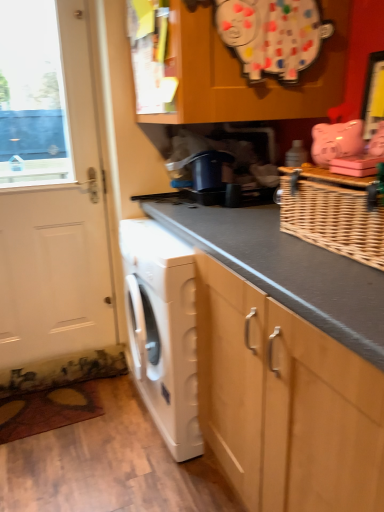
What do you see at coordinates (163, 330) in the screenshot? I see `white matte washing machine at lower left` at bounding box center [163, 330].

What are the coordinates of `wooden cabinet at upper center` in the screenshot? It's located at (244, 78).

Between point (172, 30) and point (382, 244), which one is positioned in front?

The point (382, 244) is closer.

Is woven brown basket at upper right inside wooden cabinet at upper center?

No.

From a real-world perspective, is wooden cabinet at upper center positioned over woven brown basket at upper right based on gravity?

Indeed, from a real-world perspective, wooden cabinet at upper center stands above woven brown basket at upper right.

Between wooden cabinet at upper center and woven brown basket at upper right, which one has smaller width?

woven brown basket at upper right.

Based on the photo, which is closer, (x=15, y=355) or (x=213, y=62)?

Clearly, point (x=15, y=355) is more distant from the camera than point (x=213, y=62).

From the image's perspective, between white matte door at left and wooden cabinet at upper center, which one is located above?

From the image's view, wooden cabinet at upper center is above.

Considering the sizes of objects white matte door at left and wooden cabinet at upper center in the image provided, who is bigger, white matte door at left or wooden cabinet at upper center?

With larger size is wooden cabinet at upper center.

Are wooden cabinet at upper center and white matte washing machine at lower left far apart?

No, wooden cabinet at upper center is in close proximity to white matte washing machine at lower left.

How many degrees apart are the facing directions of wooden cabinet at upper center and white matte washing machine at lower left?

The facing directions of wooden cabinet at upper center and white matte washing machine at lower left are 87.9 degrees apart.

Looking at this image, can we say wooden cabinet at upper center lies outside white matte washing machine at lower left?

Yes, wooden cabinet at upper center is outside of white matte washing machine at lower left.

From the image's perspective, between white matte washing machine at lower left and wooden cabinet at upper center, who is located below?

white matte washing machine at lower left appears lower in the image.

Which of these two, white matte washing machine at lower left or wooden cabinet at upper center, is bigger?

With larger size is white matte washing machine at lower left.

Which is farther, (129, 362) or (257, 108)?

The point (129, 362) is more distant.

Is white matte washing machine at lower left positioned far away from wooden cabinet at upper center?

white matte washing machine at lower left is actually quite close to wooden cabinet at upper center.

Based on the photo, from a real-world perspective, is white matte door at left positioned over woven brown basket at upper right based on gravity?

→ Actually, white matte door at left is physically below woven brown basket at upper right in the real world.

Is white matte door at left not close to woven brown basket at upper right?

Indeed, white matte door at left is not near woven brown basket at upper right.

Find the location of a particular element. This screenshot has width=384, height=512. door behind the woven brown basket at upper right is located at coordinates (51, 191).

Who is bigger, white matte door at left or woven brown basket at upper right?

white matte door at left is bigger.

Does woven brown basket at upper right turn towards wooden cabinet at upper center?

No, woven brown basket at upper right is not turned towards wooden cabinet at upper center.

Between point (314, 183) and point (337, 7), which one is positioned in front?

The point (314, 183) is closer to the camera.

Identify the location of cabinetry behind the woven brown basket at upper right. (244, 78).

Considering the relative positions of woven brown basket at upper right and wooden cabinet at upper center in the image provided, is woven brown basket at upper right to the left or to the right of wooden cabinet at upper center?

woven brown basket at upper right is positioned on wooden cabinet at upper center's right side.

In the scene shown: Who is more distant, white matte washing machine at lower left or white matte door at left?

white matte door at left is more distant.

From a real-world perspective, does white matte washing machine at lower left stand above white matte door at left?

No, from a real-world perspective, white matte washing machine at lower left is not on top of white matte door at left.

Could you tell me if white matte washing machine at lower left is turned towards white matte door at left?

No.

In the scene shown: Would you say white matte washing machine at lower left is a long distance from white matte door at left?

That's not correct — white matte washing machine at lower left is a little close to white matte door at left.

Where is `cabinetry lying on the left of woven brown basket at upper right`? cabinetry lying on the left of woven brown basket at upper right is located at coordinates (244, 78).

Find the location of a particular element. This screenshot has width=384, height=512. door below the wooden cabinet at upper center (from the image's perspective) is located at coordinates (51, 191).

From the picture: When comparing their distances from woven brown basket at upper right, does wooden cabinet at upper center or white matte washing machine at lower left seem closer?

wooden cabinet at upper center is closer to woven brown basket at upper right.

Which object lies further to the anchor point white matte door at left, woven brown basket at upper right or wooden cabinet at upper center?

woven brown basket at upper right is further to white matte door at left.

Based on their spatial positions, is white matte door at left or white matte washing machine at lower left further from wooden cabinet at upper center?

The object further to wooden cabinet at upper center is white matte door at left.

Estimate the real-world distances between objects in this image. Which object is further from woven brown basket at upper right, white matte washing machine at lower left or white matte door at left?

white matte door at left is positioned further to the anchor woven brown basket at upper right.

In the scene shown: When comparing their distances from woven brown basket at upper right, does white matte door at left or wooden cabinet at upper center seem further?

The object further to woven brown basket at upper right is white matte door at left.

From the image, which object appears to be nearer to woven brown basket at upper right, white matte washing machine at lower left or wooden cabinet at upper center?

Among the two, wooden cabinet at upper center is located nearer to woven brown basket at upper right.

Estimate the real-world distances between objects in this image. Which object is further from wooden cabinet at upper center, white matte washing machine at lower left or woven brown basket at upper right?

white matte washing machine at lower left lies further to wooden cabinet at upper center than the other object.

Which object lies nearer to the anchor point white matte door at left, wooden cabinet at upper center or white matte washing machine at lower left?

Among the two, white matte washing machine at lower left is located nearer to white matte door at left.

You are a GUI agent. You are given a task and a screenshot of the screen. Output one action in this format:
    pyautogui.click(x=<x>, y=<y>)
    Task: Click on the cabinetry located between white matte door at left and woven brown basket at upper right in the left-right direction
    
    Given the screenshot: What is the action you would take?
    pyautogui.click(x=244, y=78)

The height and width of the screenshot is (512, 384). What are the coordinates of `basket between wooden cabinet at upper center and white matte washing machine at lower left vertically` in the screenshot? It's located at (334, 212).

Identify the location of washing machine situated between white matte door at left and woven brown basket at upper right from left to right. (163, 330).

Identify the location of door between wooden cabinet at upper center and white matte washing machine at lower left in the up-down direction. (51, 191).